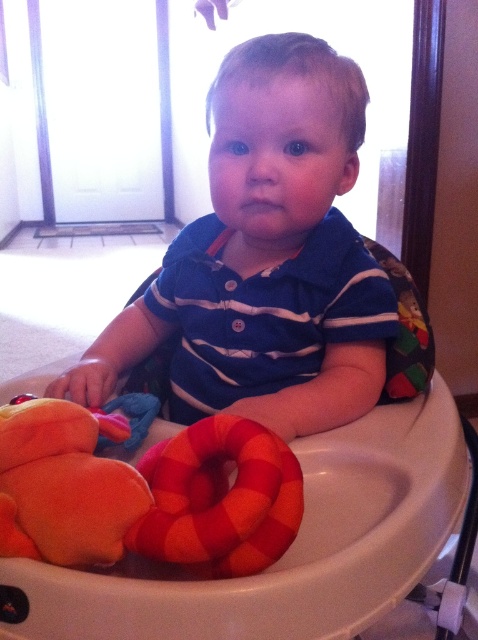
Question: Can you confirm if plush fabric ring at lower center is positioned to the right of soft plush toy at lower left?

Choices:
 (A) no
 (B) yes

Answer: (B)

Question: Which object is closer to the camera taking this photo?

Choices:
 (A) plush fabric ring at lower center
 (B) blue striped shirt at center
 (C) soft plush toy at lower left
 (D) white plastic walker at center

Answer: (A)

Question: Does blue striped shirt at center have a smaller size compared to white plastic walker at center?

Choices:
 (A) yes
 (B) no

Answer: (A)

Question: Which point is farther to the camera?

Choices:
 (A) (340, 248)
 (B) (12, 404)
 (C) (201, 451)
 (D) (387, 621)

Answer: (D)

Question: Which point is closer to the camera?

Choices:
 (A) (241, 180)
 (B) (436, 444)
 (C) (54, 442)

Answer: (C)

Question: Is white plastic walker at center positioned at the back of soft plush toy at lower left?

Choices:
 (A) yes
 (B) no

Answer: (A)